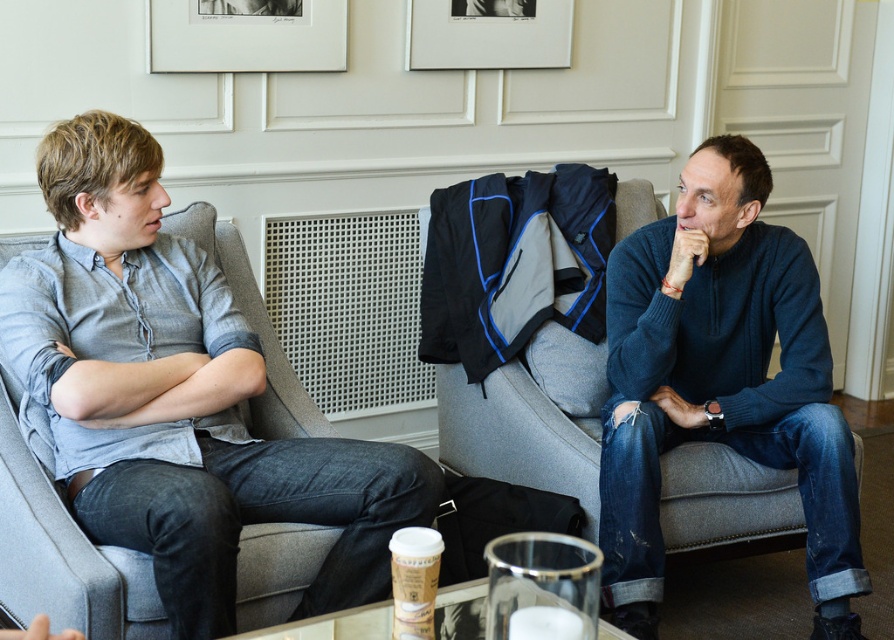
You are standing in a living room and want to hang a new picture frame that is 3 meters long. There is already a matte white picture frame at upper center. Can you hang your new picture frame in the same spot without overlapping?

The matte white picture frame at upper center is 2.90 meters from viewer. Since your new picture frame is 3 meters long, it would overlap with the existing one if placed in the same spot.

You are a photographer taking a picture of the light gray shirt at left and the white matte picture frame at upper center. Which object should you focus on first if you want to capture both in sharp focus?

The light gray shirt at left is positioned under the white matte picture frame at upper center, so you should focus on the white matte picture frame at upper center first to ensure both are in focus since it is closer to the camera.